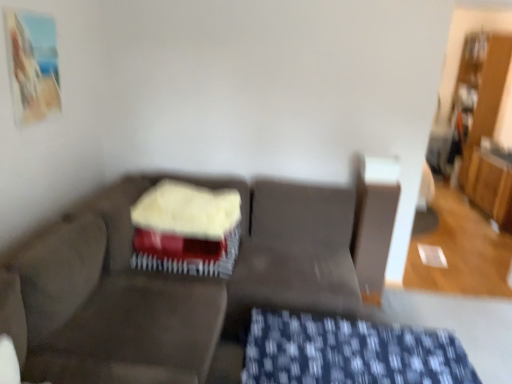
Question: From a real-world perspective, is smooth red cake at center above or below blue textured fabric at lower center?

Choices:
 (A) above
 (B) below

Answer: (A)

Question: Based on their sizes in the image, would you say smooth red cake at center is bigger or smaller than blue textured fabric at lower center?

Choices:
 (A) small
 (B) big

Answer: (A)

Question: Considering the real-world distances, which object is closest to the velvet-like beige swivel chair at center?

Choices:
 (A) dark gray fabric couch at center
 (B) smooth red cake at center
 (C) blue textured fabric at lower center

Answer: (A)

Question: Estimate the real-world distances between objects in this image. Which object is farther from the dark gray fabric couch at center?

Choices:
 (A) smooth red cake at center
 (B) blue textured fabric at lower center
 (C) velvet-like beige swivel chair at center

Answer: (B)